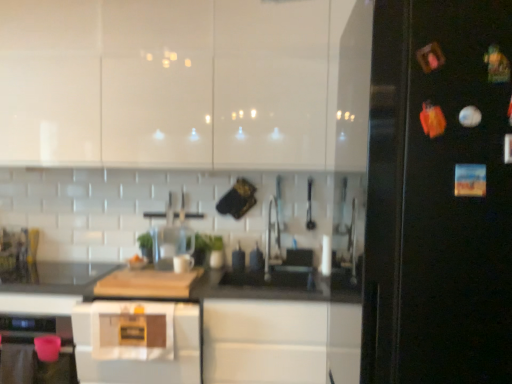
Question: From a real-world perspective, is clear glass blender at center positioned above or below black glossy fridge at right?

Choices:
 (A) above
 (B) below

Answer: (B)

Question: In terms of size, does clear glass blender at center appear bigger or smaller than black glossy fridge at right?

Choices:
 (A) big
 (B) small

Answer: (B)

Question: Which of these objects is positioned farthest from the white glossy cabinets at upper center?

Choices:
 (A) black glossy fridge at right
 (B) black matte countertop at center
 (C) white glossy microwave at center
 (D) clear glass blender at center

Answer: (A)

Question: Estimate the real-world distances between objects in this image. Which object is closer to the white glossy cabinets at upper center?

Choices:
 (A) white glossy microwave at center
 (B) clear glass blender at center
 (C) black glossy fridge at right
 (D) black matte countertop at center

Answer: (B)